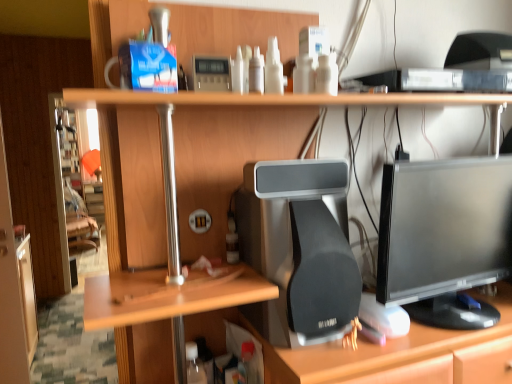
Question: Does matte black desktop computer at center have a lesser height compared to black glossy monitor at center right?

Choices:
 (A) no
 (B) yes

Answer: (B)

Question: From a real-world perspective, is matte black desktop computer at center beneath black glossy monitor at center right?

Choices:
 (A) yes
 (B) no

Answer: (A)

Question: Would you say matte black desktop computer at center contains black glossy monitor at center right?

Choices:
 (A) yes
 (B) no

Answer: (B)

Question: Is matte black desktop computer at center positioned before black glossy monitor at center right?

Choices:
 (A) no
 (B) yes

Answer: (A)

Question: Does matte black desktop computer at center have a greater height compared to black glossy monitor at center right?

Choices:
 (A) yes
 (B) no

Answer: (B)

Question: From the image's perspective, relative to matte black desktop computer at center, is wooden desk at center above or below?

Choices:
 (A) below
 (B) above

Answer: (A)

Question: Is wooden desk at center wider or thinner than matte black desktop computer at center?

Choices:
 (A) thin
 (B) wide

Answer: (B)

Question: Considering the positions of wooden desk at center and matte black desktop computer at center in the image, is wooden desk at center taller or shorter than matte black desktop computer at center?

Choices:
 (A) tall
 (B) short

Answer: (A)

Question: Is point (116, 170) positioned closer to the camera than point (278, 271)?

Choices:
 (A) closer
 (B) farther

Answer: (B)

Question: Considering the positions of black glossy monitor at center right and wooden desk at center in the image, is black glossy monitor at center right wider or thinner than wooden desk at center?

Choices:
 (A) wide
 (B) thin

Answer: (B)

Question: Do you think black glossy monitor at center right is within wooden desk at center, or outside of it?

Choices:
 (A) inside
 (B) outside

Answer: (A)

Question: In terms of height, does black glossy monitor at center right look taller or shorter compared to wooden desk at center?

Choices:
 (A) tall
 (B) short

Answer: (B)

Question: Relative to wooden desk at center, is black glossy monitor at center right in front or behind?

Choices:
 (A) behind
 (B) front

Answer: (A)

Question: From a real-world perspective, relative to black glossy monitor at center right, is wooden desk at center vertically above or below?

Choices:
 (A) above
 (B) below

Answer: (B)

Question: Would you say wooden desk at center is inside or outside black glossy monitor at center right?

Choices:
 (A) outside
 (B) inside

Answer: (A)